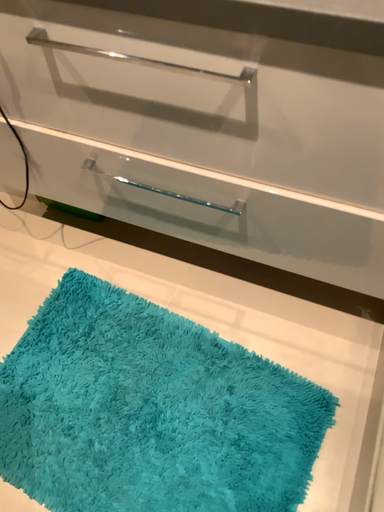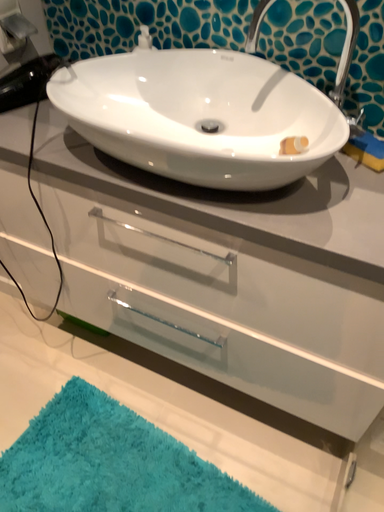
Question: How did the camera likely rotate when shooting the video?

Choices:
 (A) rotated downward
 (B) rotated upward

Answer: (B)